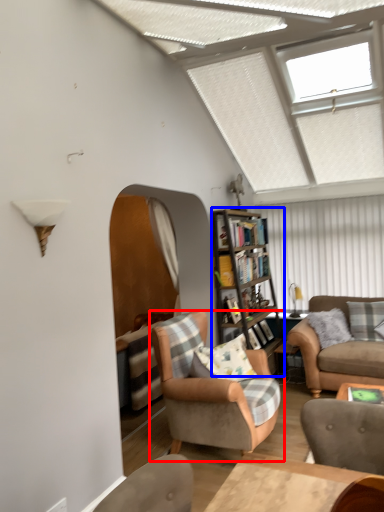
Question: Which point is closer to the camera, chair (highlighted by a red box) or bookcase (highlighted by a blue box)?

Choices:
 (A) chair
 (B) bookcase

Answer: (A)